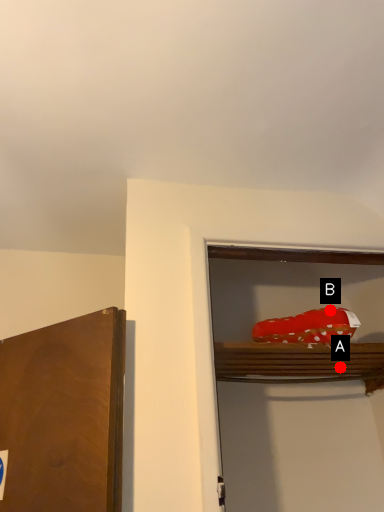
Question: Two points are circled on the image, labeled by A and B beside each circle. Among these points, which one is farthest from the camera?

Choices:
 (A) A is further
 (B) B is further

Answer: (A)